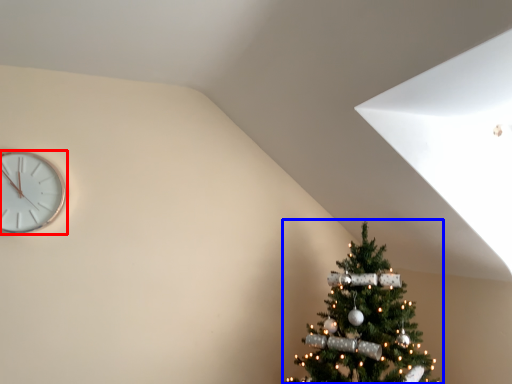
Question: Which point is closer to the camera, wall clock (highlighted by a red box) or christmas tree (highlighted by a blue box)?

Choices:
 (A) wall clock
 (B) christmas tree

Answer: (B)